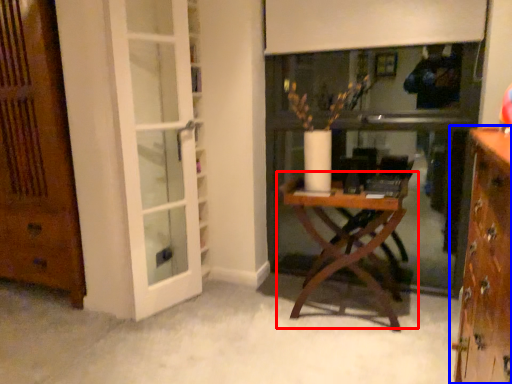
Question: Which object appears closest to the camera in this image, table (highlighted by a red box) or cabinetry (highlighted by a blue box)?

Choices:
 (A) table
 (B) cabinetry

Answer: (B)